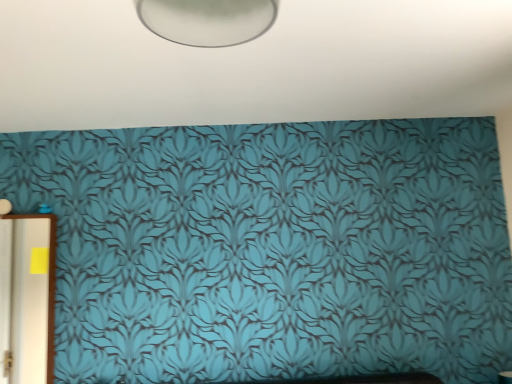
Question: Can you confirm if teal wallpaper at center is taller than white glossy door at left?

Choices:
 (A) no
 (B) yes

Answer: (A)

Question: From the image's perspective, does teal wallpaper at center appear higher than white glossy door at left?

Choices:
 (A) yes
 (B) no

Answer: (A)

Question: Is teal wallpaper at center far from white glossy door at left?

Choices:
 (A) yes
 (B) no

Answer: (A)

Question: Is teal wallpaper at center positioned with its back to white glossy door at left?

Choices:
 (A) no
 (B) yes

Answer: (A)

Question: Considering the relative sizes of teal wallpaper at center and white glossy door at left in the image provided, is teal wallpaper at center bigger than white glossy door at left?

Choices:
 (A) yes
 (B) no

Answer: (A)

Question: From a real-world perspective, is teal wallpaper at center positioned under white glossy door at left based on gravity?

Choices:
 (A) no
 (B) yes

Answer: (A)

Question: Considering the relative sizes of white glossy door at left and teal wallpaper at center in the image provided, is white glossy door at left smaller than teal wallpaper at center?

Choices:
 (A) yes
 (B) no

Answer: (A)

Question: Considering the relative sizes of white glossy door at left and teal wallpaper at center in the image provided, is white glossy door at left bigger than teal wallpaper at center?

Choices:
 (A) yes
 (B) no

Answer: (B)

Question: Is white glossy door at left positioned beyond the bounds of teal wallpaper at center?

Choices:
 (A) no
 (B) yes

Answer: (B)

Question: Considering the relative sizes of white glossy door at left and teal wallpaper at center in the image provided, is white glossy door at left wider than teal wallpaper at center?

Choices:
 (A) yes
 (B) no

Answer: (B)

Question: From a real-world perspective, is white glossy door at left on top of teal wallpaper at center?

Choices:
 (A) yes
 (B) no

Answer: (B)

Question: Is the position of white glossy door at left more distant than that of teal wallpaper at center?

Choices:
 (A) yes
 (B) no

Answer: (A)

Question: Is white glossy door at left inside or outside of teal wallpaper at center?

Choices:
 (A) outside
 (B) inside

Answer: (A)